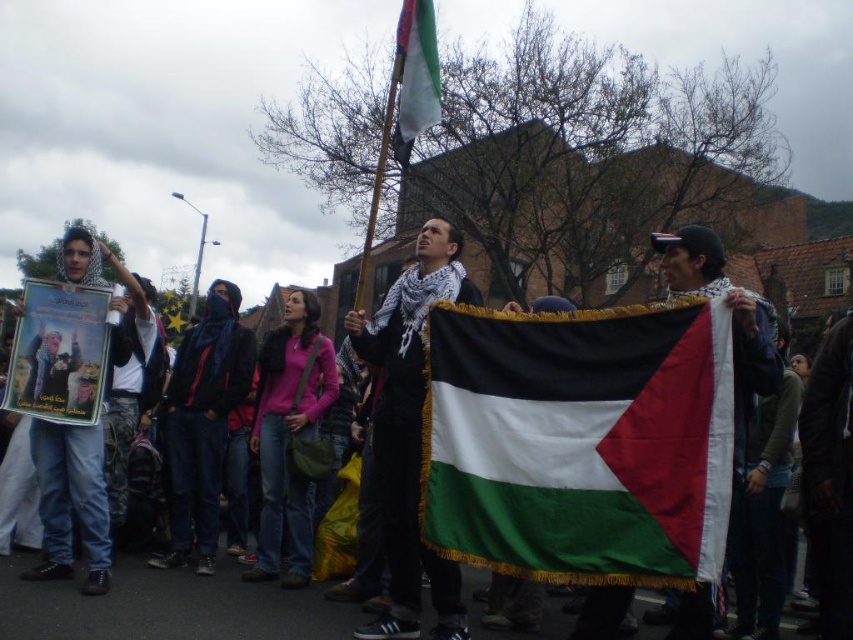
Does white textured scarf at center appear under white fabric flag at upper center?

Indeed, white textured scarf at center is positioned under white fabric flag at upper center.

Which is more to the left, white textured scarf at center or white fabric flag at upper center?

white fabric flag at upper center

Who is more forward, (439, 289) or (405, 40)?

Point (405, 40)

The image size is (853, 640). I want to click on white textured scarf at center, so click(409, 433).

Does matte black scarf at center have a smaller size compared to white fabric flag at upper center?

Yes, matte black scarf at center is smaller than white fabric flag at upper center.

Is point (727, 298) in front of point (408, 36)?

Yes, point (727, 298) is closer to viewer.

Between point (675, 280) and point (412, 84), which one is positioned in front?

Point (675, 280)

Locate an element on the screen. matte black scarf at center is located at coordinates (732, 317).

Image resolution: width=853 pixels, height=640 pixels. Describe the element at coordinates (409, 433) in the screenshot. I see `white textured scarf at center` at that location.

This screenshot has width=853, height=640. Describe the element at coordinates (409, 433) in the screenshot. I see `white textured scarf at center` at that location.

The height and width of the screenshot is (640, 853). In order to click on white textured scarf at center in this screenshot , I will do `click(409, 433)`.